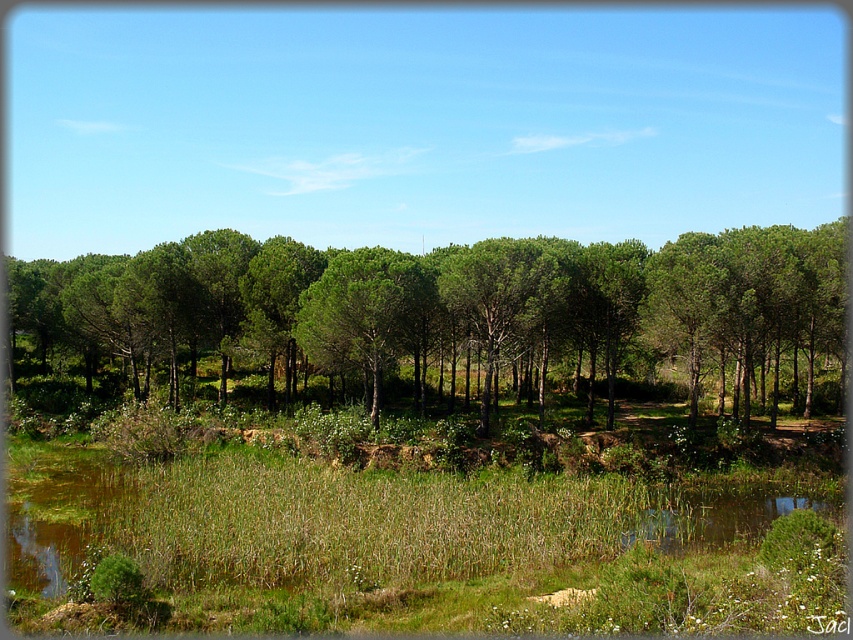
Question: Which object appears farthest from the camera in this image?

Choices:
 (A) green leafy tree at center
 (B) green matte tree at center

Answer: (B)

Question: Which point is farther to the camera?

Choices:
 (A) (149, 253)
 (B) (416, 381)

Answer: (B)

Question: Is green leafy tree at center to the left of green matte tree at center from the viewer's perspective?

Choices:
 (A) no
 (B) yes

Answer: (B)

Question: In this image, where is green leafy tree at center located relative to green matte tree at center?

Choices:
 (A) right
 (B) left

Answer: (B)

Question: Does green leafy tree at center lie in front of green matte tree at center?

Choices:
 (A) no
 (B) yes

Answer: (B)

Question: Which of the following is the farthest from the observer?

Choices:
 (A) (509, 326)
 (B) (337, 298)

Answer: (A)